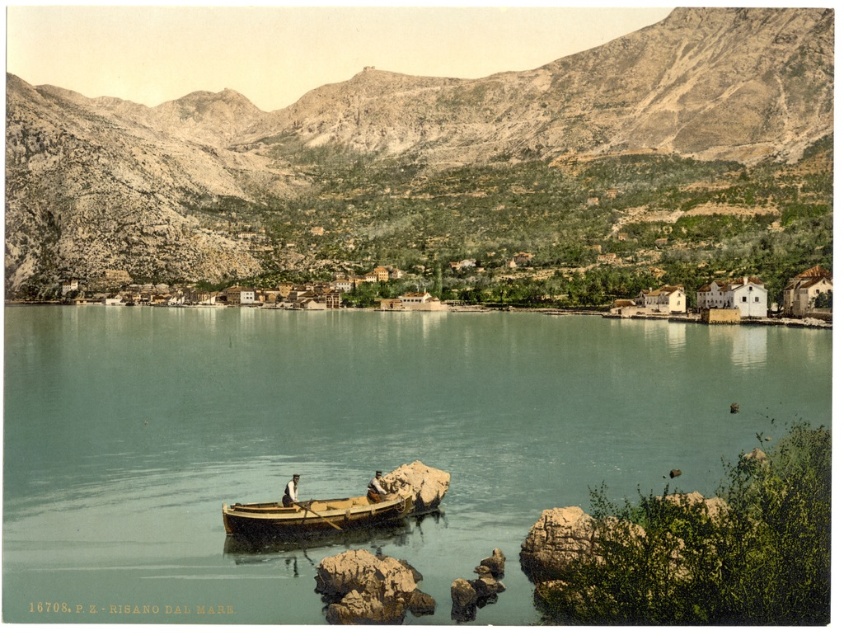
Measure the distance between rugged stone mountain at center and wooden boat at lower center.

They are 166.66 meters apart.

Who is taller, rugged stone mountain at center or wooden boat at lower center?

With more height is rugged stone mountain at center.

Is point (791, 17) more distant than point (372, 490)?

Yes.

Locate an element on the screen. Image resolution: width=844 pixels, height=640 pixels. rugged stone mountain at center is located at coordinates (396, 147).

Does clear blue water at center come behind wooden canoe at center?

No, it is in front of wooden canoe at center.

Between clear blue water at center and wooden canoe at center, which one is positioned lower?

wooden canoe at center

This screenshot has height=640, width=844. Find the location of `clear blue water at center`. clear blue water at center is located at coordinates (349, 440).

Find the location of `clear blue water at center`. clear blue water at center is located at coordinates coord(349,440).

Is clear blue water at center to the left of wooden boat at lower center from the viewer's perspective?

Yes, clear blue water at center is to the left of wooden boat at lower center.

Between point (556, 332) and point (285, 493), which one is positioned in front?

Point (285, 493)

Does point (46, 611) come behind point (360, 500)?

No, it is in front of (360, 500).

This screenshot has width=844, height=640. In order to click on clear blue water at center in this screenshot , I will do `click(349, 440)`.